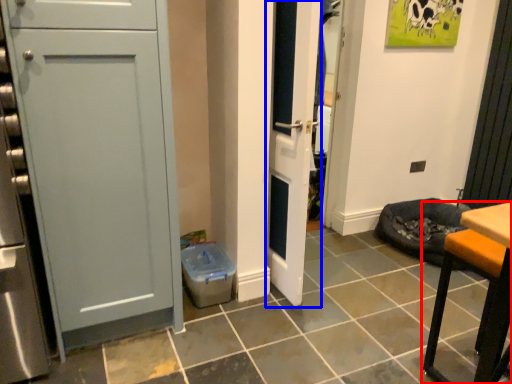
Question: Which of the following is the closest to the observer, furniture (highlighted by a red box) or door (highlighted by a blue box)?

Choices:
 (A) furniture
 (B) door

Answer: (A)